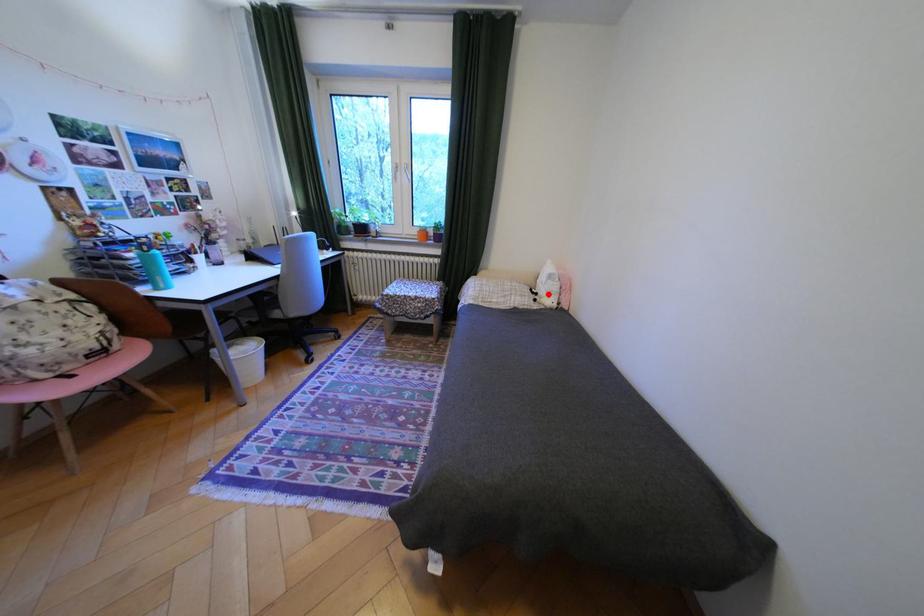
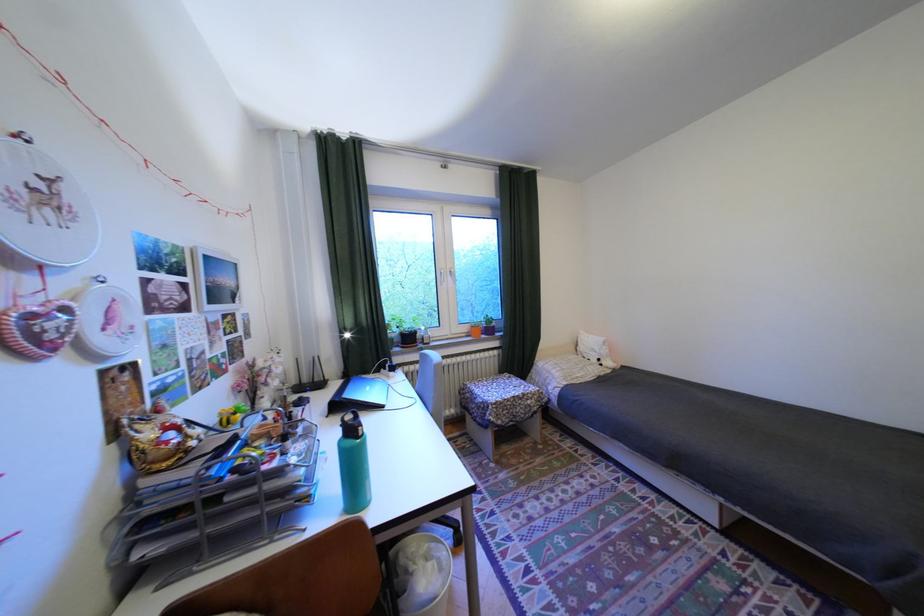
The point at the highlighted location is marked in the first image. Where is the corresponding point in the second image?

(611, 360)